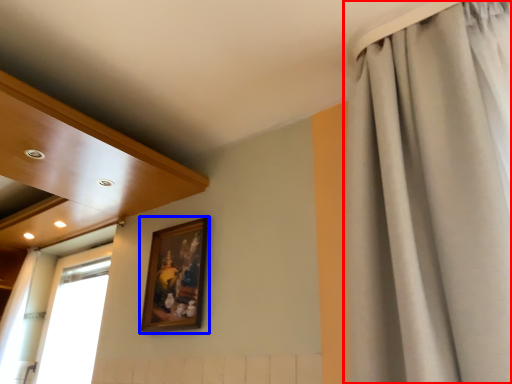
Question: Among these objects, which one is nearest to the camera, curtain (highlighted by a red box) or picture frame (highlighted by a blue box)?

Choices:
 (A) curtain
 (B) picture frame

Answer: (A)